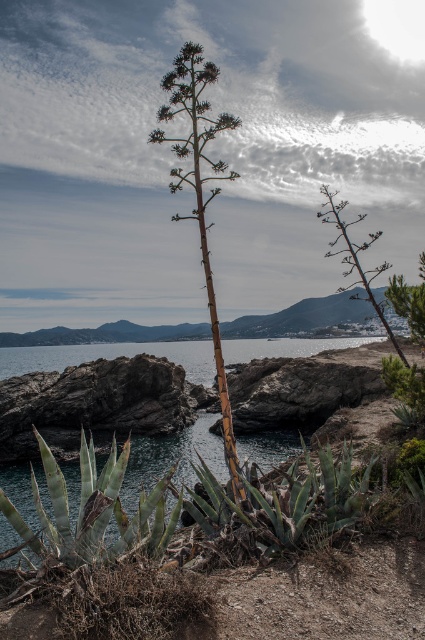
You are a hiker who wants to place a 1.2 meter wide tent between the dark gray rock at center and the brown woody stem at center. Can you fit the tent there?

The dark gray rock at center is wider than the brown woody stem at center, but the exact width difference isn not specified. Without knowing the actual width of the space between them, it is impossible to determine if the tent will fit.

You are standing at the edge of the coastal landscape and want to place a small flag between the dark gray rock at center and the brown woody stem at center. Based on their positions, which object should the flag be closer to?

The dark gray rock at center is to the left of the brown woody stem at center, so the flag should be placed closer to the dark gray rock at center to be between them.

You are standing at the edge of the coastal landscape and looking towards the middle ground. Which object is closer to you between the dark gray rock at center and the green spiky plant at center?

The dark gray rock at center is closer to you since the green spiky plant at center is positioned behind it.